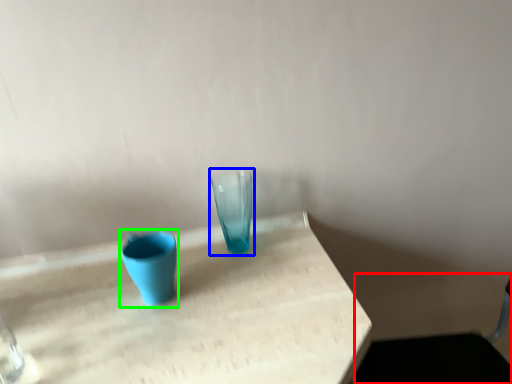
Question: Considering the real-world distances, which object is closest to swivel chair (highlighted by a red box)? vase (highlighted by a blue box) or vase (highlighted by a green box).

Choices:
 (A) vase
 (B) vase

Answer: (A)